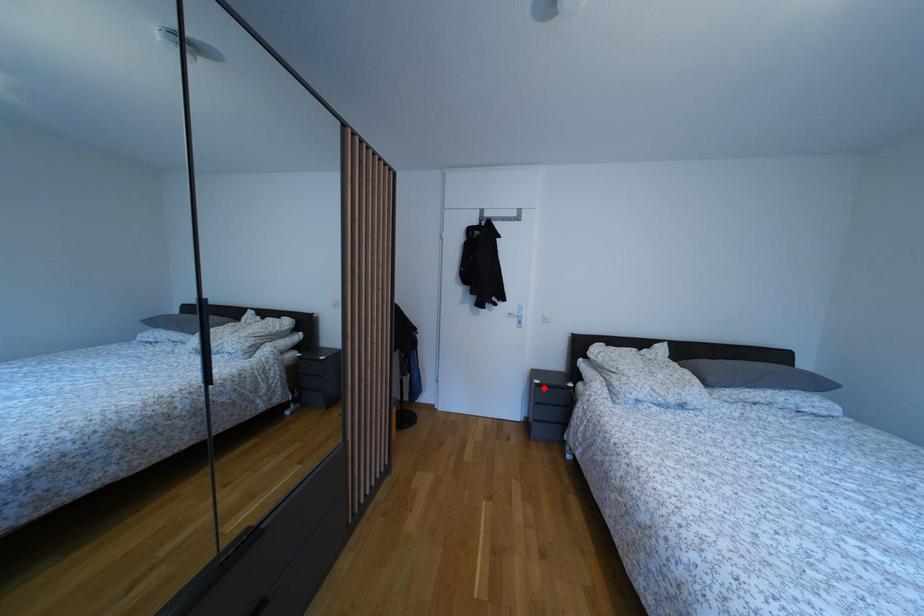
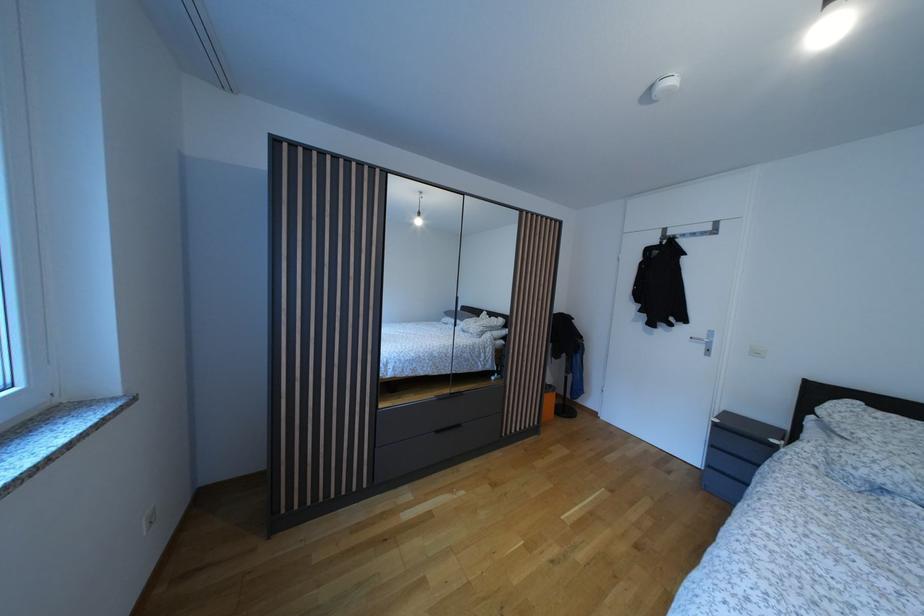
Where in the second image is the point corresponding to the highlighted location from the first image?

(723, 427)